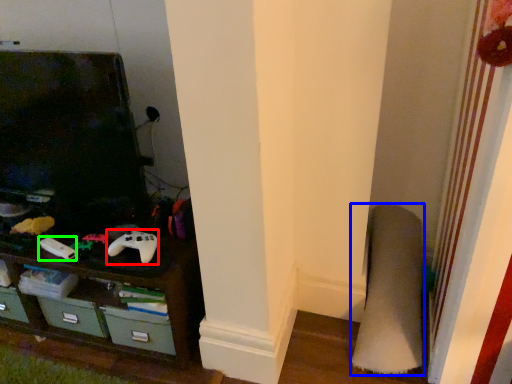
Question: Which is farther away from game controller (highlighted by a red box)? plain (highlighted by a blue box) or game controller (highlighted by a green box)?

Choices:
 (A) plain
 (B) game controller

Answer: (A)